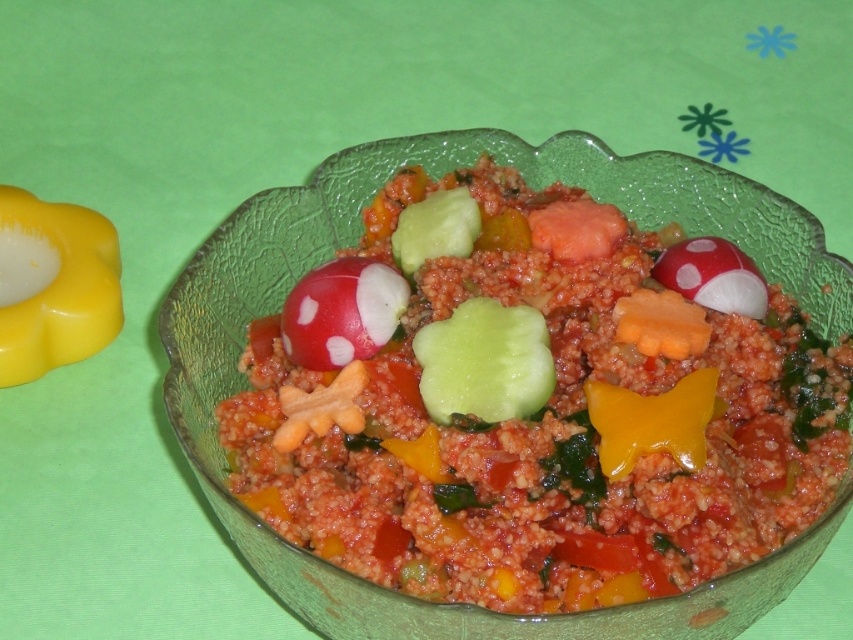
You are a food stylist arranging a dish and need to place a 3.5 inch wide decorative plate between the smooth red radish at center and the green smooth cucumber at center. Will the plate fit between them?

The smooth red radish at center and green smooth cucumber at center are 3.32 inches apart. Since the decorative plate is 3.5 inches wide, it will not fit between them as the distance is slightly smaller than the plate.

Looking at this image, you are a food stylist arranging a dish. You have a smooth red radish at center and a green smooth cucumber at center. According to the image, which object is positioned to the right side of the other?

The smooth red radish at center is to the right of the green smooth cucumber at center.

You are a food stylist arranging this dish. You need to place a small edible decoration on top of the smooth red radish at center. Will the decoration also be above the green smooth cucumber at center?

Yes, since the smooth red radish at center is above the green smooth cucumber at center, placing the decoration on top of the smooth red radish at center will also place it above the green smooth cucumber at center.